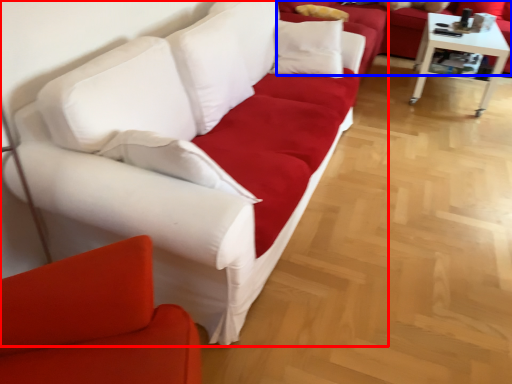
Question: Which object is further to the camera taking this photo, studio couch (highlighted by a red box) or studio couch (highlighted by a blue box)?

Choices:
 (A) studio couch
 (B) studio couch

Answer: (B)